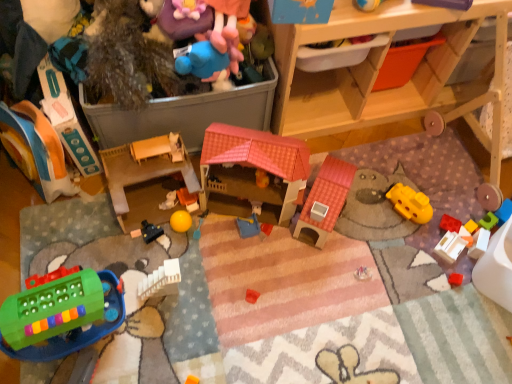
Where is `empty space that is in between white plastic toy at lower right, which is counted as the tenth toy, starting from the left, and blue plastic toy at center, the ninth toy positioned from the left`? The width and height of the screenshot is (512, 384). empty space that is in between white plastic toy at lower right, which is counted as the tenth toy, starting from the left, and blue plastic toy at center, the ninth toy positioned from the left is located at coordinates (354, 243).